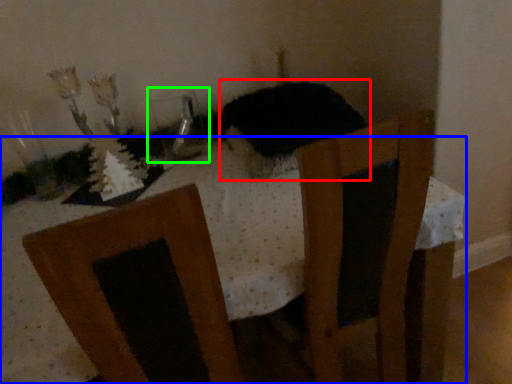
Question: Which is farther away from animal (highlighted by a red box)? table (highlighted by a blue box) or glass vase (highlighted by a green box)?

Choices:
 (A) table
 (B) glass vase

Answer: (B)